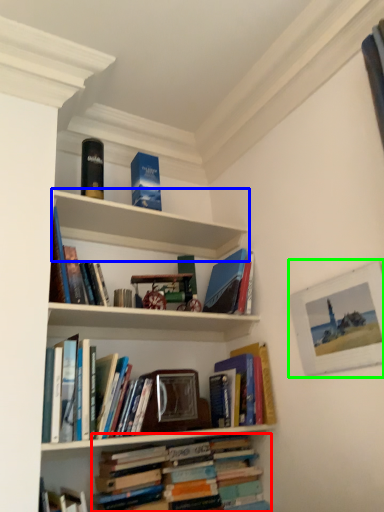
Question: Which is nearer to the book (highlighted by a red box)? shelf (highlighted by a blue box) or picture frame (highlighted by a green box).

Choices:
 (A) shelf
 (B) picture frame

Answer: (B)